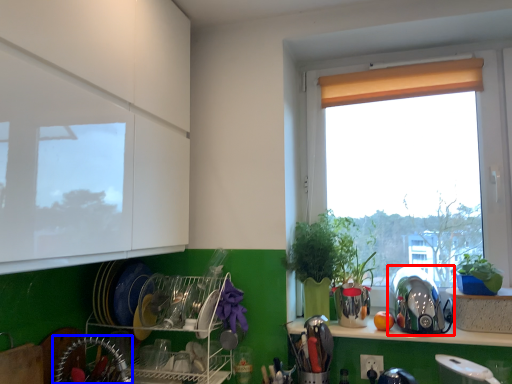
Question: Which of the following is the closest to the observer, appliance (highlighted by a red box) or appliance (highlighted by a blue box)?

Choices:
 (A) appliance
 (B) appliance

Answer: (B)